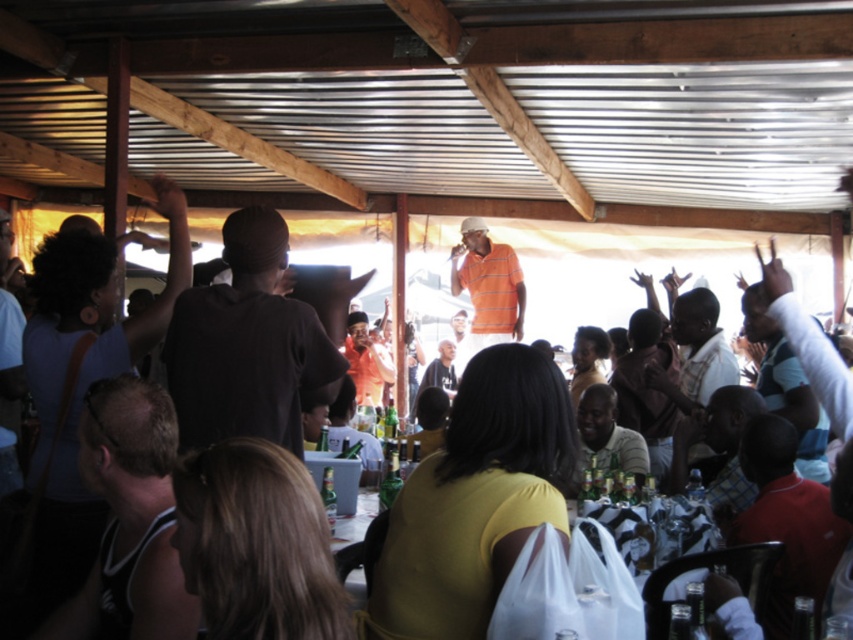
You are a photographer at the event and want to capture both the black matte shirt at center and the orange striped polo shirt at center in a single photo. Which person should you position closer to the camera to ensure both are fully visible?

The black matte shirt at center is not as tall as orange striped polo shirt at center, so you should position the black matte shirt at center closer to the camera to ensure both are fully visible.